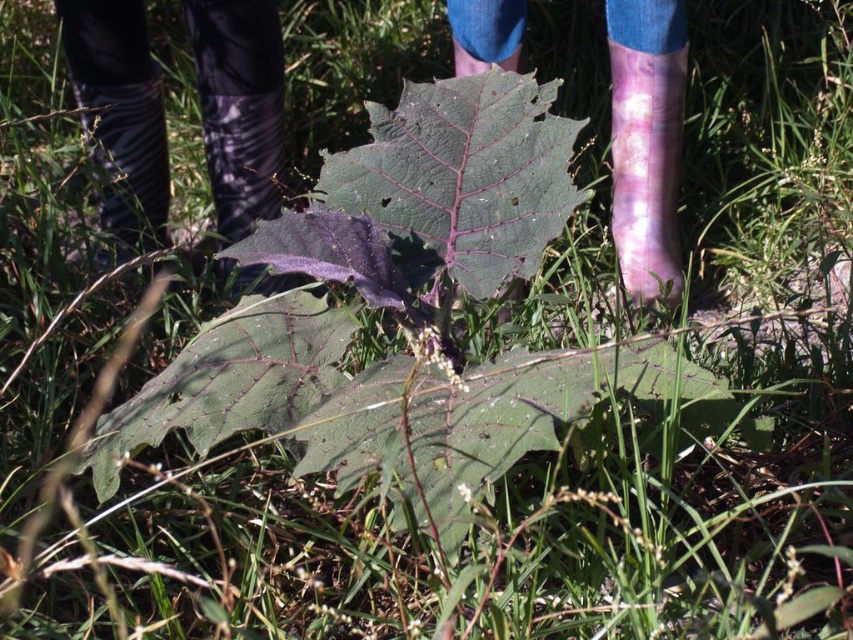
Who is positioned more to the left, purple matte boots at center or green matte leaf at center?

purple matte boots at center

Is point (102, 221) positioned behind point (247, 339)?

Yes, point (102, 221) is behind point (247, 339).

Find the location of a particular element. The image size is (853, 640). purple matte boots at center is located at coordinates point(119,115).

Is point (115, 144) farther from camera compared to point (216, 147)?

No, it is not.

Does zebra-patterned rubber boot at left have a smaller size compared to matte black boot at center?

Indeed, zebra-patterned rubber boot at left has a smaller size compared to matte black boot at center.

Is point (128, 93) positioned before point (216, 109)?

No, (128, 93) is behind (216, 109).

I want to click on zebra-patterned rubber boot at left, so click(126, 163).

Can you confirm if purple matte boots at center is taller than matte black boot at center?

Yes, purple matte boots at center is taller than matte black boot at center.

Is point (231, 193) positioned before point (273, 184)?

Yes.

Does point (161, 230) come farther from viewer compared to point (225, 144)?

Yes, it is behind point (225, 144).

At what (x,y) coordinates should I click in order to perform the action: click on purple matte boots at center. Please return your answer as a coordinate pair (x, y). The height and width of the screenshot is (640, 853). Looking at the image, I should click on point(119,115).